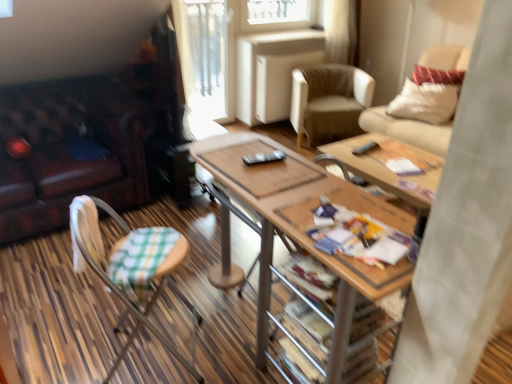
Image resolution: width=512 pixels, height=384 pixels. Find the location of `vacant space in between black plastic remote control at center, which is the second remote control in top-to-bottom order, and printed paper magazine at center`. vacant space in between black plastic remote control at center, which is the second remote control in top-to-bottom order, and printed paper magazine at center is located at coordinates (300, 190).